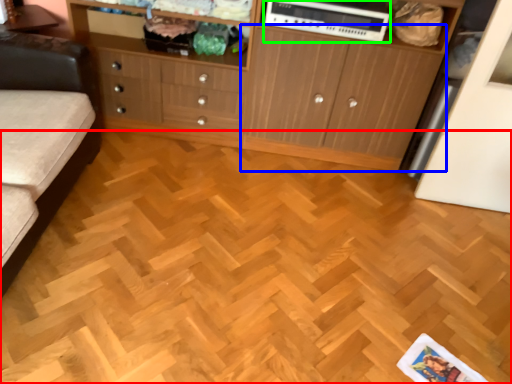
Question: Which object is positioned farthest from plywood (highlighted by a red box)? Select from cupboard (highlighted by a blue box) and appliance (highlighted by a green box).

Choices:
 (A) cupboard
 (B) appliance

Answer: (B)